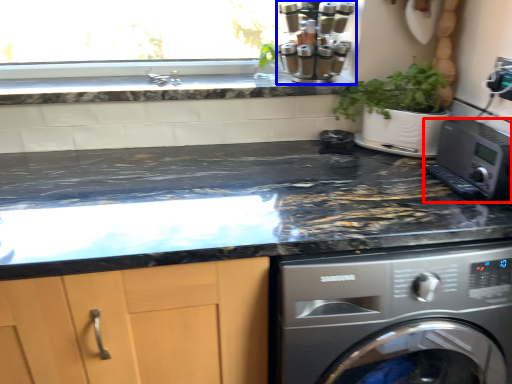
Question: Among these objects, which one is farthest to the camera, home appliance (highlighted by a red box) or coffee machine (highlighted by a blue box)?

Choices:
 (A) home appliance
 (B) coffee machine

Answer: (B)